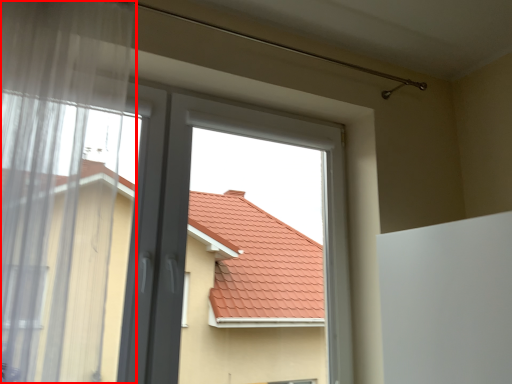
Question: Considering the relative positions of window (annotated by the red box) and bay window in the image provided, where is window (annotated by the red box) located with respect to the staircase?

Choices:
 (A) left
 (B) right

Answer: (A)